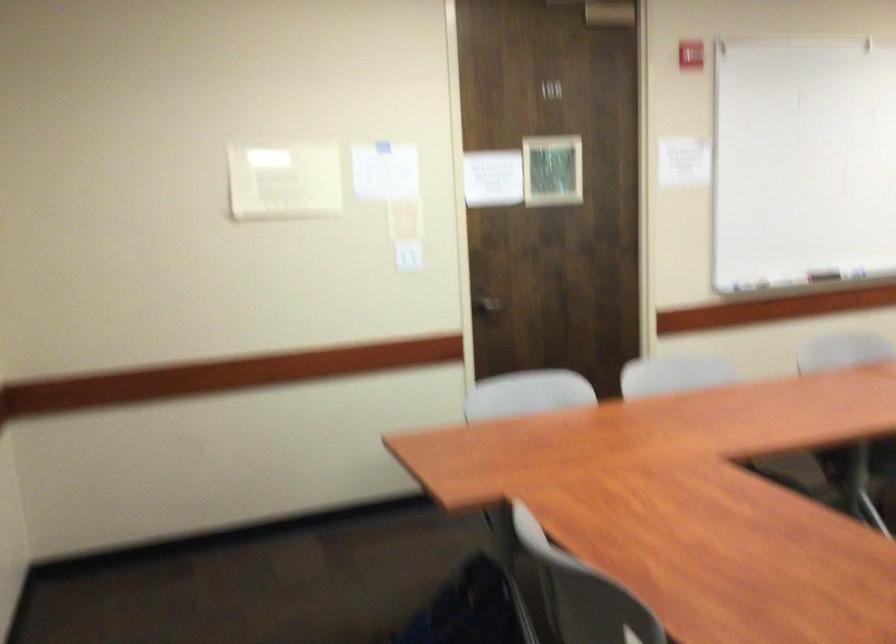
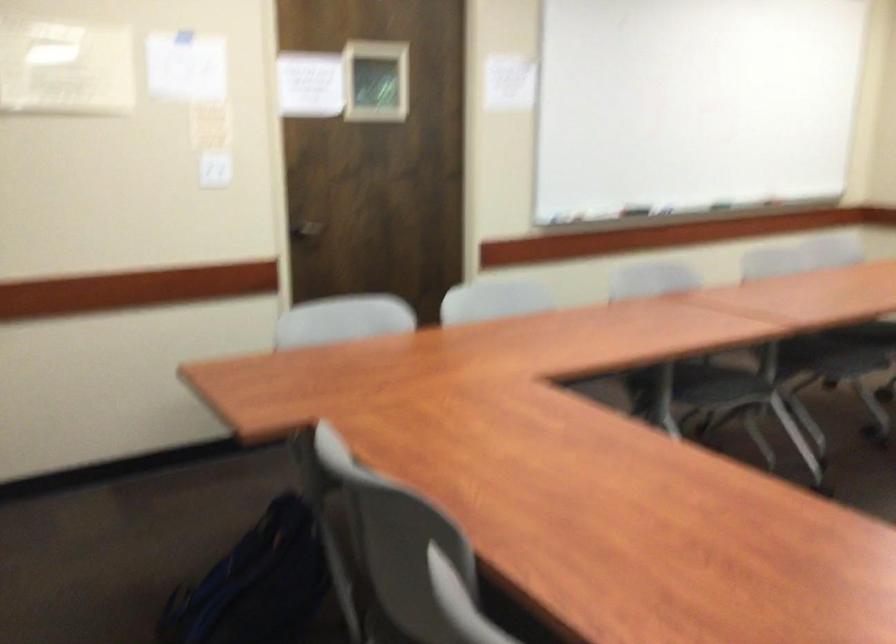
Find the pixel in the second image that matches [492,301] in the first image.

(306, 228)